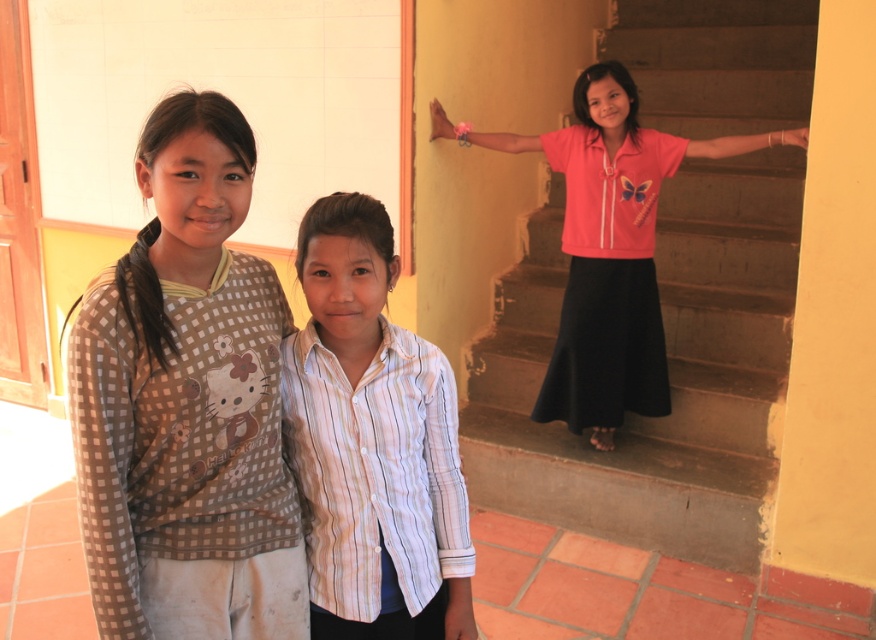
You are a photographer trying to capture a group photo of the two girls in the foreground and the one on the staircase. The camera you have can only focus on subjects within a 1.2 meters range. Will all three girls fit within the camera focus range if you position yourself between the brown checkered shirt at left and the other girl?

The two girls in the foreground are 1.26 meters apart. Since the camera can only focus within 1.2 meters, positioning yourself between them would mean the distance from the camera to each girl might exceed the focus range. Therefore, not all three girls will fit within the camera focus range.

You are a photographer trying to capture a group photo of the two girls in the scene. You want to position them so that the white striped shirt at center and the pink satin blouse at upper right are both visible in the frame. Based on their positions, which direction should you move the camera to include both?

The white striped shirt at center is to the left of the pink satin blouse at upper right, so moving the camera to the right would ensure both are visible in the frame.